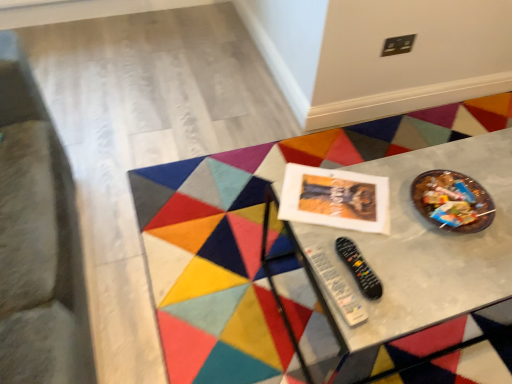
This screenshot has height=384, width=512. Find the location of `metallic gray table at center`. metallic gray table at center is located at coordinates (329, 263).

How much space does black plastic remote at center, placed as the second control when sorted from left to right, occupy vertically?

black plastic remote at center, placed as the second control when sorted from left to right, is 2.08 inches tall.

At what (x,y) coordinates should I click in order to perform the action: click on metallic gray table at center. Please return your answer as a coordinate pair (x, y). Looking at the image, I should click on (329, 263).

Based on the photo, from the image's perspective, which object appears higher, metallic gray table at center or black plastic remote at center, placed as the second control when sorted from left to right?

From the image's view, metallic gray table at center is above.

Is metallic gray table at center touching black plastic remote at center, the first control when ordered from right to left?

They are not placed beside each other.

Considering the relative sizes of metallic gray table at center and black plastic remote at center, placed as the second control when sorted from left to right, in the image provided, is metallic gray table at center bigger than black plastic remote at center, placed as the second control when sorted from left to right,?

Yes.

Looking at their sizes, would you say metallic gray table at center is wider or thinner than black plastic remote at center, placed as the second control when sorted from left to right?

Considering their sizes, metallic gray table at center looks broader than black plastic remote at center, placed as the second control when sorted from left to right.

How many degrees apart are the facing directions of metallic gray table at center and black plastic remote at lower center, placed as the first control when sorted from left to right?

metallic gray table at center and black plastic remote at lower center, placed as the first control when sorted from left to right, are facing 97.3 degrees away from each other.

Is metallic gray table at center in front of or behind black plastic remote at lower center, arranged as the 2th control when viewed from the right, in the image?

In the image, metallic gray table at center appears behind black plastic remote at lower center, arranged as the 2th control when viewed from the right.

Considering the relative sizes of metallic gray table at center and black plastic remote at lower center, arranged as the 2th control when viewed from the right, in the image provided, is metallic gray table at center shorter than black plastic remote at lower center, arranged as the 2th control when viewed from the right,?

In fact, metallic gray table at center may be taller than black plastic remote at lower center, arranged as the 2th control when viewed from the right.

Could you tell me if metallic gray table at center is turned towards black plastic remote at lower center, arranged as the 2th control when viewed from the right?

No, metallic gray table at center is not facing towards black plastic remote at lower center, arranged as the 2th control when viewed from the right.

Based on the photo, considering the sizes of objects black plastic remote at center, the first control when ordered from right to left, and black plastic remote at lower center, arranged as the 2th control when viewed from the right, in the image provided, who is smaller, black plastic remote at center, the first control when ordered from right to left, or black plastic remote at lower center, arranged as the 2th control when viewed from the right,?

black plastic remote at lower center, arranged as the 2th control when viewed from the right.

In the scene shown: Does black plastic remote at center, placed as the second control when sorted from left to right, have a greater height compared to black plastic remote at lower center, arranged as the 2th control when viewed from the right?

Indeed, black plastic remote at center, placed as the second control when sorted from left to right, has a greater height compared to black plastic remote at lower center, arranged as the 2th control when viewed from the right.

Is black plastic remote at center, the first control when ordered from right to left, positioned in front of black plastic remote at lower center, arranged as the 2th control when viewed from the right?

No, it is not.

From the image's perspective, is black plastic remote at center, placed as the second control when sorted from left to right, located above or below black plastic remote at lower center, arranged as the 2th control when viewed from the right?

black plastic remote at center, placed as the second control when sorted from left to right, is situated higher than black plastic remote at lower center, arranged as the 2th control when viewed from the right, in the image.

From the image's perspective, is black plastic remote at lower center, placed as the first control when sorted from left to right, located above or below metallic gray table at center?

black plastic remote at lower center, placed as the first control when sorted from left to right, is situated lower than metallic gray table at center in the image.

From a real-world perspective, is black plastic remote at lower center, placed as the first control when sorted from left to right, positioned under metallic gray table at center based on gravity?

No, from a real-world perspective, black plastic remote at lower center, placed as the first control when sorted from left to right, is not beneath metallic gray table at center.

From the picture: Is black plastic remote at lower center, arranged as the 2th control when viewed from the right, touching metallic gray table at center?

black plastic remote at lower center, arranged as the 2th control when viewed from the right, and metallic gray table at center are not in contact.

From a real-world perspective, who is located higher, black plastic remote at lower center, arranged as the 2th control when viewed from the right, or black plastic remote at center, the first control when ordered from right to left?

black plastic remote at lower center, arranged as the 2th control when viewed from the right.

Can you tell me how much black plastic remote at lower center, arranged as the 2th control when viewed from the right, and black plastic remote at center, placed as the second control when sorted from left to right, differ in facing direction?

The facing directions of black plastic remote at lower center, arranged as the 2th control when viewed from the right, and black plastic remote at center, placed as the second control when sorted from left to right, are 5.3 degrees apart.

Find the location of a particular element. The width and height of the screenshot is (512, 384). control located above the black plastic remote at center, placed as the second control when sorted from left to right (from a real-world perspective) is located at coordinates (337, 286).

Can you confirm if black plastic remote at lower center, arranged as the 2th control when viewed from the right, is taller than black plastic remote at center, placed as the second control when sorted from left to right?

In fact, black plastic remote at lower center, arranged as the 2th control when viewed from the right, may be shorter than black plastic remote at center, placed as the second control when sorted from left to right.

Would you say black plastic remote at center, placed as the second control when sorted from left to right, contains metallic gray table at center?

That's incorrect, metallic gray table at center is not inside black plastic remote at center, placed as the second control when sorted from left to right.

Based on the photo, can you confirm if black plastic remote at center, placed as the second control when sorted from left to right, is shorter than metallic gray table at center?

Indeed, black plastic remote at center, placed as the second control when sorted from left to right, has a lesser height compared to metallic gray table at center.

Is point (349, 252) positioned behind point (378, 255)?

No, it is not.

Locate an element on the screen. table above the black plastic remote at center, the first control when ordered from right to left (from the image's perspective) is located at coordinates (329, 263).

Identify the location of control that is the 1st one when counting forward from the metallic gray table at center. (359, 268).

From a real-world perspective, which control is the 2nd one above the metallic gray table at center? Please provide its 2D coordinates.

[(337, 286)]

Based on their spatial positions, is black plastic remote at lower center, placed as the first control when sorted from left to right, or black plastic remote at center, placed as the second control when sorted from left to right, further from metallic gray table at center?

The object further to metallic gray table at center is black plastic remote at center, placed as the second control when sorted from left to right.

Based on their spatial positions, is metallic gray table at center or black plastic remote at center, the first control when ordered from right to left, closer to black plastic remote at lower center, placed as the first control when sorted from left to right?

black plastic remote at center, the first control when ordered from right to left.

Based on the photo, when comparing their distances from black plastic remote at center, placed as the second control when sorted from left to right, does black plastic remote at lower center, placed as the first control when sorted from left to right, or metallic gray table at center seem closer?

black plastic remote at lower center, placed as the first control when sorted from left to right, is positioned closer to the anchor black plastic remote at center, placed as the second control when sorted from left to right.

Considering their positions, is black plastic remote at center, placed as the second control when sorted from left to right, positioned closer to black plastic remote at lower center, placed as the first control when sorted from left to right, than metallic gray table at center?

The object closer to black plastic remote at lower center, placed as the first control when sorted from left to right, is black plastic remote at center, placed as the second control when sorted from left to right.

From the image, which object appears to be farther from metallic gray table at center, black plastic remote at center, placed as the second control when sorted from left to right, or black plastic remote at lower center, placed as the first control when sorted from left to right?

black plastic remote at center, placed as the second control when sorted from left to right, lies further to metallic gray table at center than the other object.

Based on their spatial positions, is metallic gray table at center or black plastic remote at lower center, placed as the first control when sorted from left to right, further from black plastic remote at center, the first control when ordered from right to left?

Among the two, metallic gray table at center is located further to black plastic remote at center, the first control when ordered from right to left.

Where is `control located between black plastic remote at lower center, placed as the first control when sorted from left to right, and metallic gray table at center in the left-right direction`? This screenshot has height=384, width=512. control located between black plastic remote at lower center, placed as the first control when sorted from left to right, and metallic gray table at center in the left-right direction is located at coordinates (359, 268).